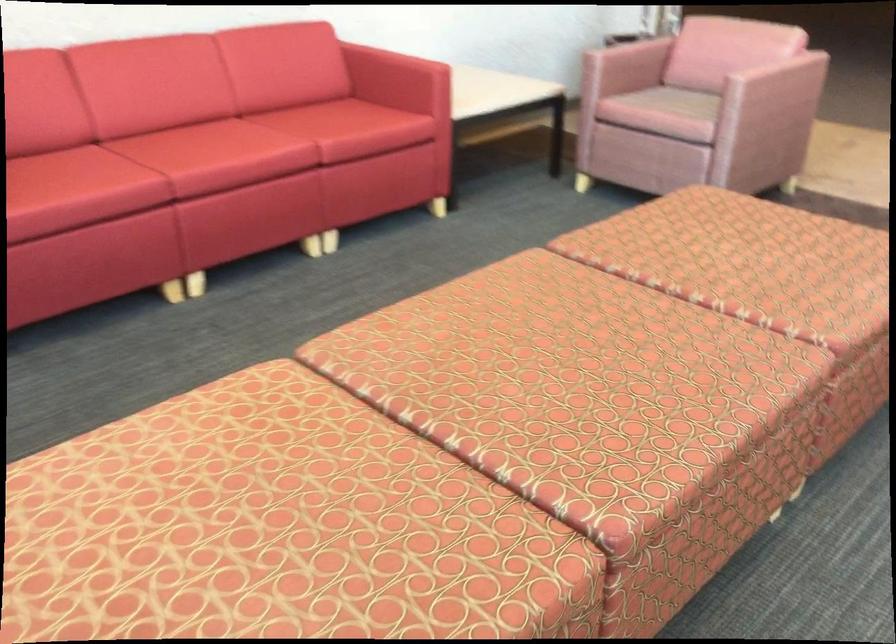
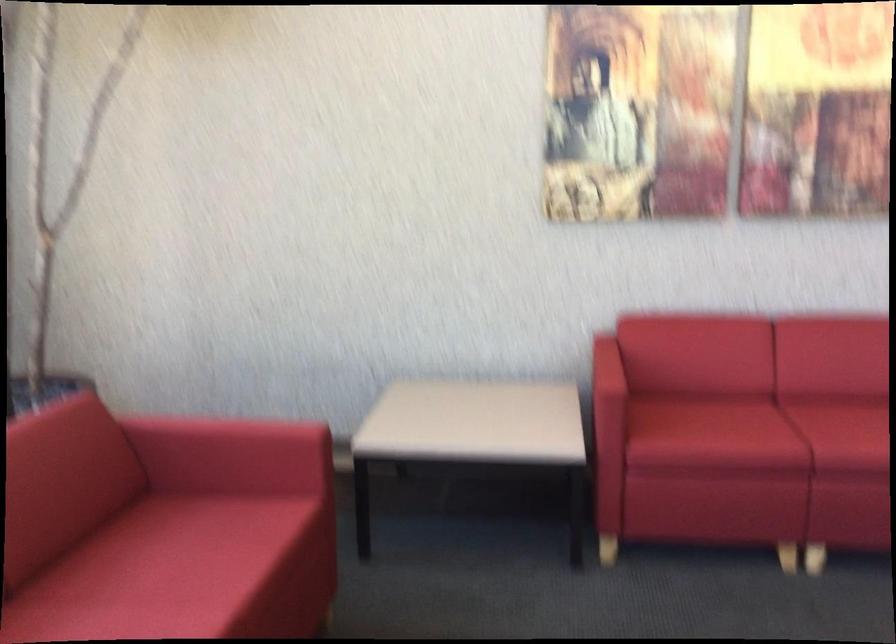
In the second image, find the point that corresponds to the point at 110,174 in the first image.

(757, 431)